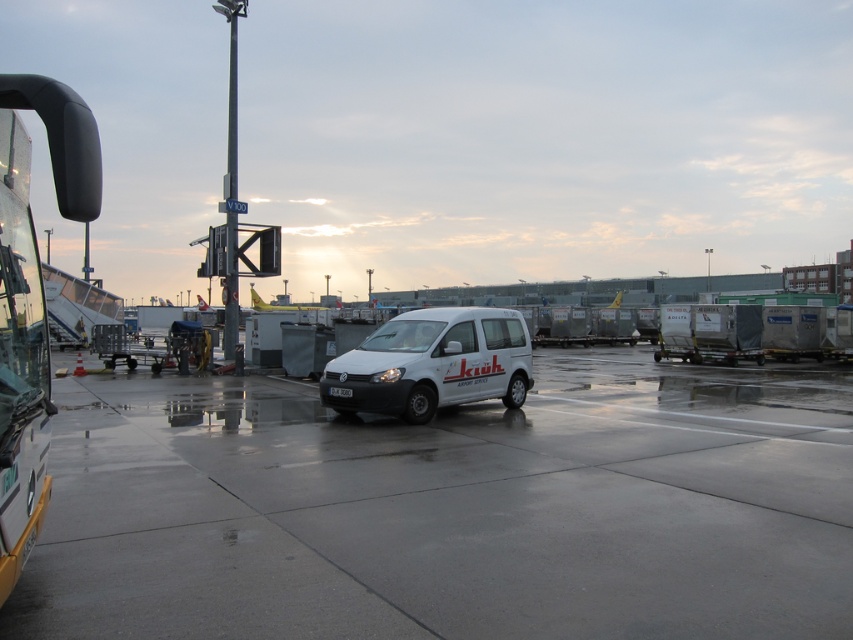
Is white concrete tarmac at center shorter than matte black bus at left?

Indeed, white concrete tarmac at center has a lesser height compared to matte black bus at left.

Is white concrete tarmac at center taller than matte black bus at left?

Incorrect, white concrete tarmac at center's height is not larger of matte black bus at left's.

Is point (486, 499) positioned behind point (9, 531)?

Yes, it is behind point (9, 531).

In order to click on white concrete tarmac at center in this screenshot , I will do `click(451, 508)`.

Which is below, white concrete tarmac at center or white matte van at center?

white concrete tarmac at center

How distant is white concrete tarmac at center from white matte van at center?

A distance of 6.95 feet exists between white concrete tarmac at center and white matte van at center.

In order to click on white concrete tarmac at center in this screenshot , I will do `click(451, 508)`.

Between matte black bus at left and white matte van at center, which one appears on the right side from the viewer's perspective?

From the viewer's perspective, white matte van at center appears more on the right side.

Looking at this image, can you confirm if matte black bus at left is thinner than white matte van at center?

Correct, matte black bus at left's width is less than white matte van at center's.

Locate an element on the screen. matte black bus at left is located at coordinates (32, 298).